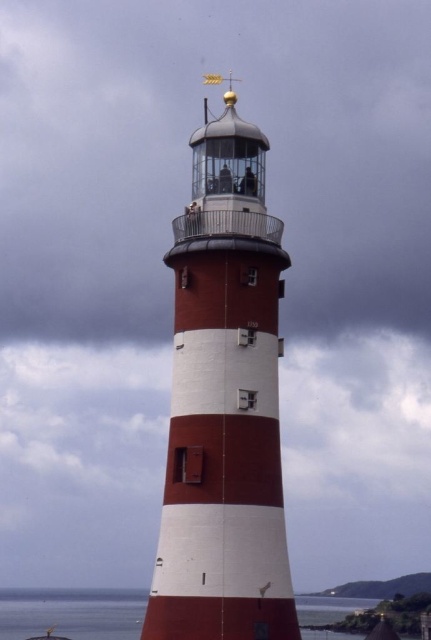
Question: Which point appears closest to the camera in this image?

Choices:
 (A) (19, 612)
 (B) (256, 378)

Answer: (B)

Question: Can you confirm if smooth white lighthouse at center is bigger than transparent water at lower left?

Choices:
 (A) no
 (B) yes

Answer: (A)

Question: Among these points, which one is farthest from the camera?

Choices:
 (A) (358, 605)
 (B) (231, 272)

Answer: (A)

Question: Is smooth white lighthouse at center wider than transparent water at lower left?

Choices:
 (A) yes
 (B) no

Answer: (B)

Question: Is smooth white lighthouse at center positioned behind transparent water at lower left?

Choices:
 (A) no
 (B) yes

Answer: (A)